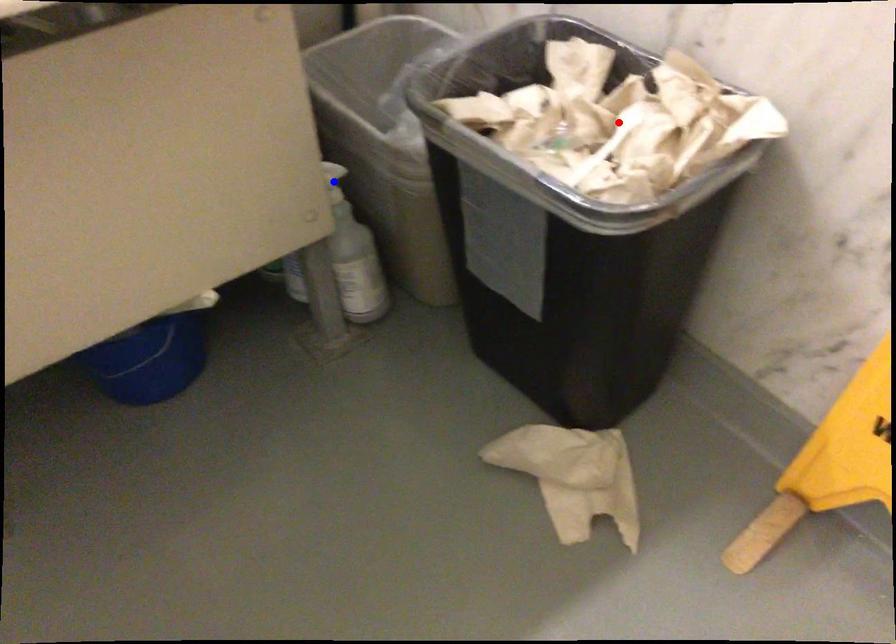
Question: Which of the two points in the image is closer to the camera?

Choices:
 (A) Blue point is closer.
 (B) Red point is closer.

Answer: (B)